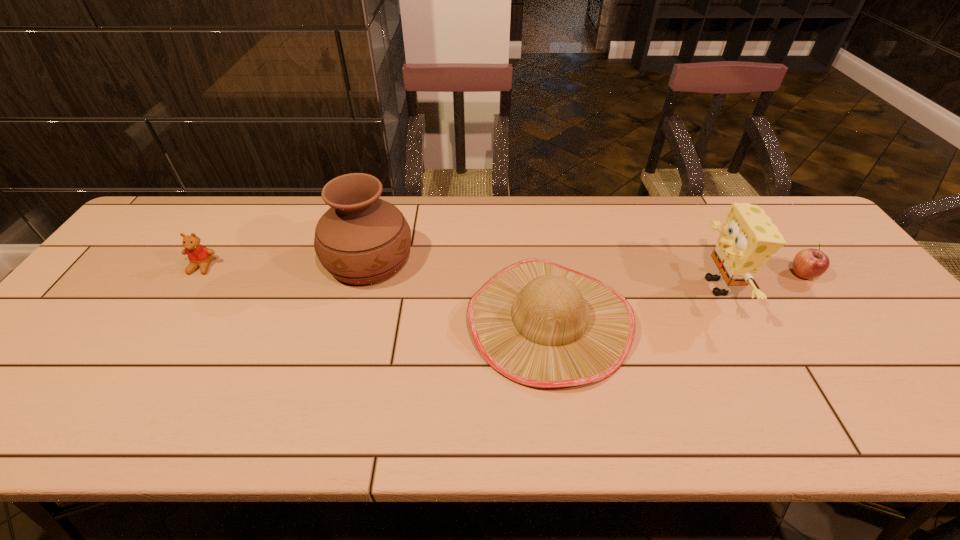
Find the location of a particular element. The image size is (960, 540). vacant space at the far left corner of the desktop is located at coordinates (201, 210).

The image size is (960, 540). In the image, there is a desktop. What are the coordinates of `vacant space at the far right corner` in the screenshot? It's located at (780, 225).

Find the location of `empty space between the second object from right to left and the leftmost object`. empty space between the second object from right to left and the leftmost object is located at coordinates (460, 276).

Where is `free point between the sponge and the leftmost object`? The width and height of the screenshot is (960, 540). free point between the sponge and the leftmost object is located at coordinates (460, 276).

Where is `free point between the apple and the second object from right to left`? free point between the apple and the second object from right to left is located at coordinates (760, 280).

I want to click on free space between the leftmost object and the urn, so click(x=285, y=263).

This screenshot has width=960, height=540. In order to click on unoccupied area between the leftmost object and the urn in this screenshot , I will do `click(285, 263)`.

Where is `free area in between the sponge and the rightmost object`? free area in between the sponge and the rightmost object is located at coordinates (760, 280).

At what (x,y) coordinates should I click in order to perform the action: click on blank region between the second object from left to right and the sunhat. Please return your answer as a coordinate pair (x, y). Looking at the image, I should click on (459, 290).

Where is `vacant area that lies between the third shortest object and the urn`? vacant area that lies between the third shortest object and the urn is located at coordinates (459, 290).